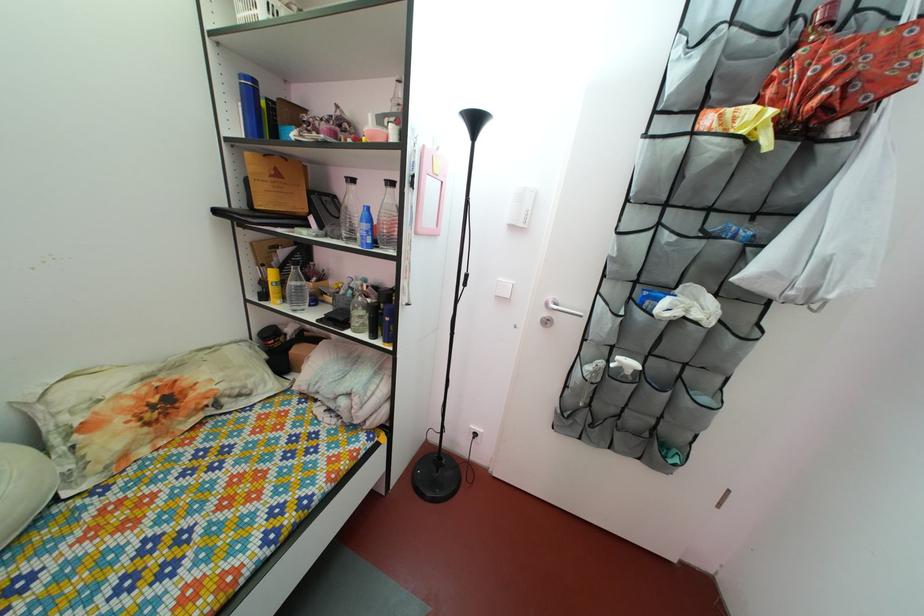
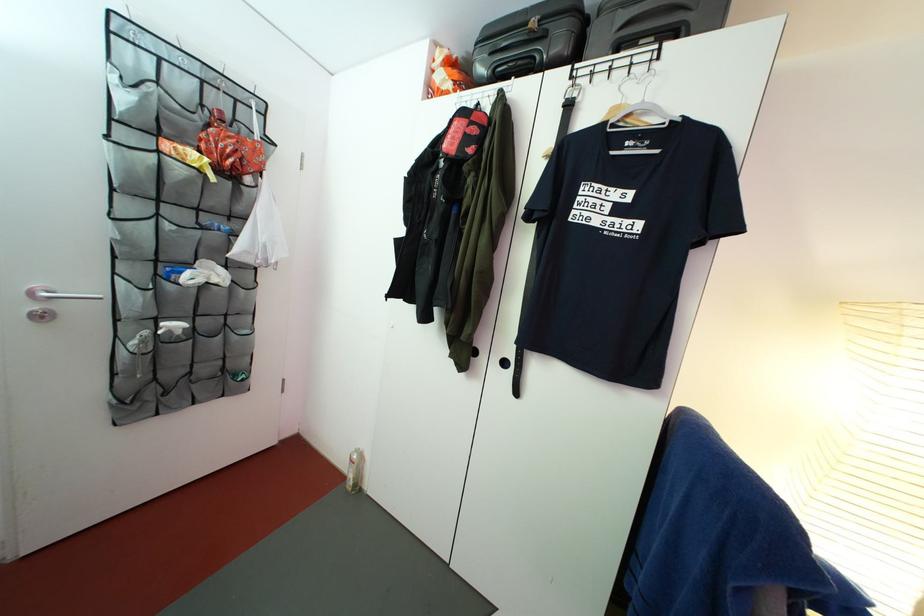
Question: The images are taken continuously from a first-person perspective. In which direction is your viewpoint rotating?

Choices:
 (A) Left
 (B) Right
 (C) Up
 (D) Down

Answer: (B)